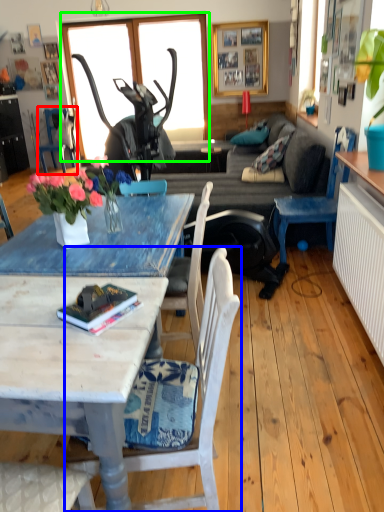
Question: Which object is the closest to the chair (highlighted by a red box)? Choose among these: chair (highlighted by a blue box) or window (highlighted by a green box).

Choices:
 (A) chair
 (B) window

Answer: (B)